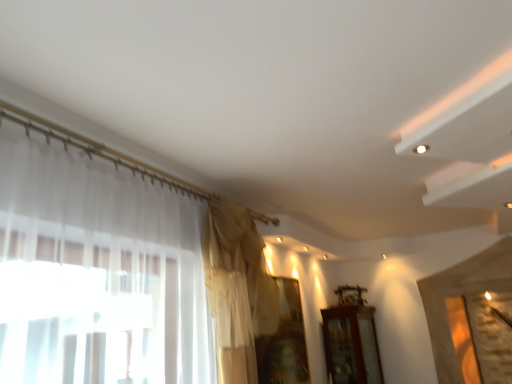
Question: From the image's perspective, would you say silky beige curtain at upper center is shown under brown wooden cabinet at lower right?

Choices:
 (A) no
 (B) yes

Answer: (A)

Question: Is the surface of silky beige curtain at upper center in direct contact with brown wooden cabinet at lower right?

Choices:
 (A) no
 (B) yes

Answer: (A)

Question: Can brown wooden cabinet at lower right be found inside silky beige curtain at upper center?

Choices:
 (A) yes
 (B) no

Answer: (B)

Question: Does silky beige curtain at upper center have a lesser width compared to brown wooden cabinet at lower right?

Choices:
 (A) no
 (B) yes

Answer: (B)

Question: From a real-world perspective, is silky beige curtain at upper center below brown wooden cabinet at lower right?

Choices:
 (A) yes
 (B) no

Answer: (B)

Question: Are silky beige curtain at upper center and brown wooden cabinet at lower right located far from each other?

Choices:
 (A) no
 (B) yes

Answer: (B)

Question: Is brown wooden cabinet at lower right oriented away from transparent fabric at center?

Choices:
 (A) yes
 (B) no

Answer: (B)

Question: Does brown wooden cabinet at lower right lie in front of transparent fabric at center?

Choices:
 (A) yes
 (B) no

Answer: (B)

Question: Is brown wooden cabinet at lower right positioned beyond the bounds of transparent fabric at center?

Choices:
 (A) no
 (B) yes

Answer: (B)

Question: Does brown wooden cabinet at lower right have a lesser width compared to transparent fabric at center?

Choices:
 (A) yes
 (B) no

Answer: (B)

Question: From the image's perspective, would you say brown wooden cabinet at lower right is positioned over transparent fabric at center?

Choices:
 (A) no
 (B) yes

Answer: (A)

Question: Considering the relative positions of brown wooden cabinet at lower right and transparent fabric at center in the image provided, is brown wooden cabinet at lower right to the right of transparent fabric at center from the viewer's perspective?

Choices:
 (A) yes
 (B) no

Answer: (A)

Question: From a real-world perspective, is silky beige curtain at upper center positioned over transparent fabric at center based on gravity?

Choices:
 (A) no
 (B) yes

Answer: (B)